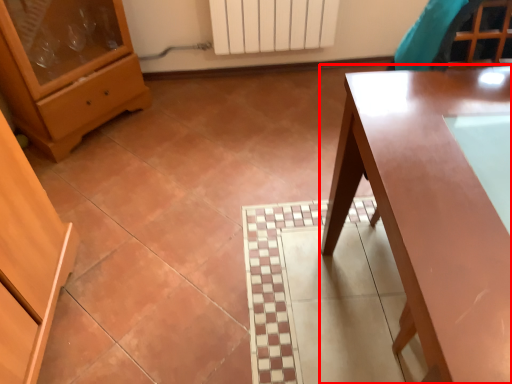
Question: From the image's perspective, what is the correct spatial relationship of table (annotated by the red box) in relation to chest of drawers?

Choices:
 (A) below
 (B) above

Answer: (A)